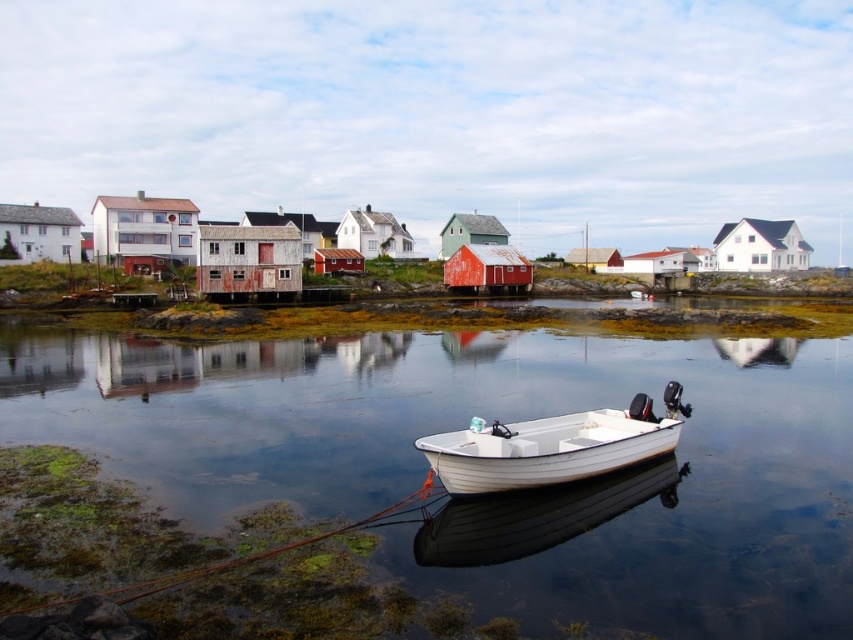
You are a photographer planning to take a photo of the clear water at center and the white wood boat at center. Based on their positions, which object would appear closer to the camera in the final image?

The clear water at center appears closer to the camera because it is taller than the white wood boat at center in the image.

You are standing on the shore of the fishing village and see the clear water at center and the white wood boat at center. Which object is closer to you?

The clear water at center is located above the white wood boat at center, so the clear water at center is closer to you.